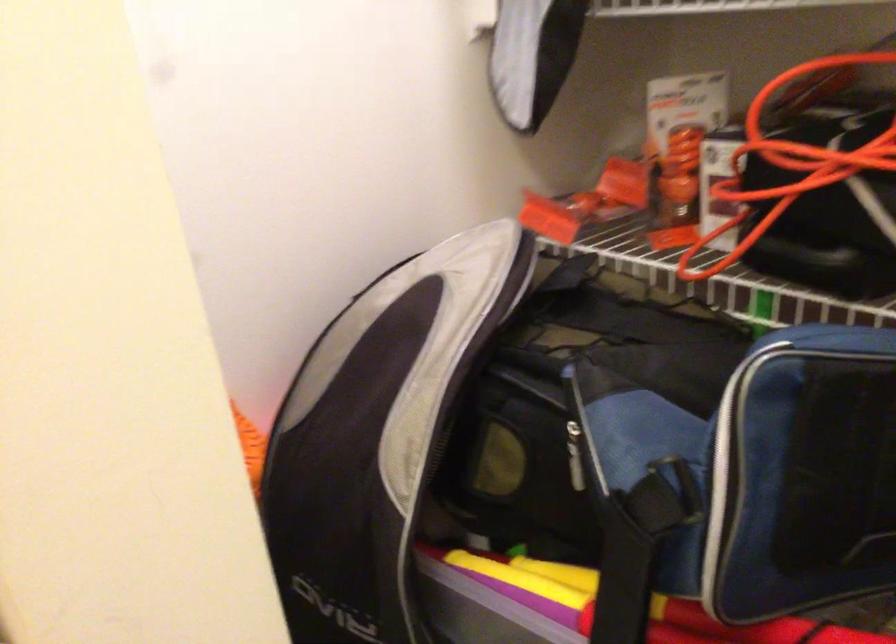
Where would you grasp the orange extension cord? Please return your answer as a coordinate pair (x, y).

(791, 163)